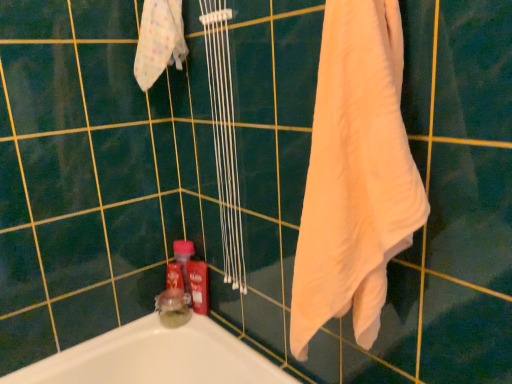
Question: Considering the positions of translucent glass jar at lower left and white soft cloth at upper left in the image, is translucent glass jar at lower left taller or shorter than white soft cloth at upper left?

Choices:
 (A) short
 (B) tall

Answer: (A)

Question: From the image's perspective, relative to white soft cloth at upper left, is translucent glass jar at lower left above or below?

Choices:
 (A) above
 (B) below

Answer: (B)

Question: Considering the real-world distances, which object is farthest from the white soft cloth at upper left?

Choices:
 (A) translucent glass jar at lower left
 (B) red glossy bottle at lower center
 (C) white soft towel at right

Answer: (A)

Question: Which object is the closest to the translucent glass jar at lower left?

Choices:
 (A) white soft towel at right
 (B) white soft cloth at upper left
 (C) red glossy bottle at lower center

Answer: (C)